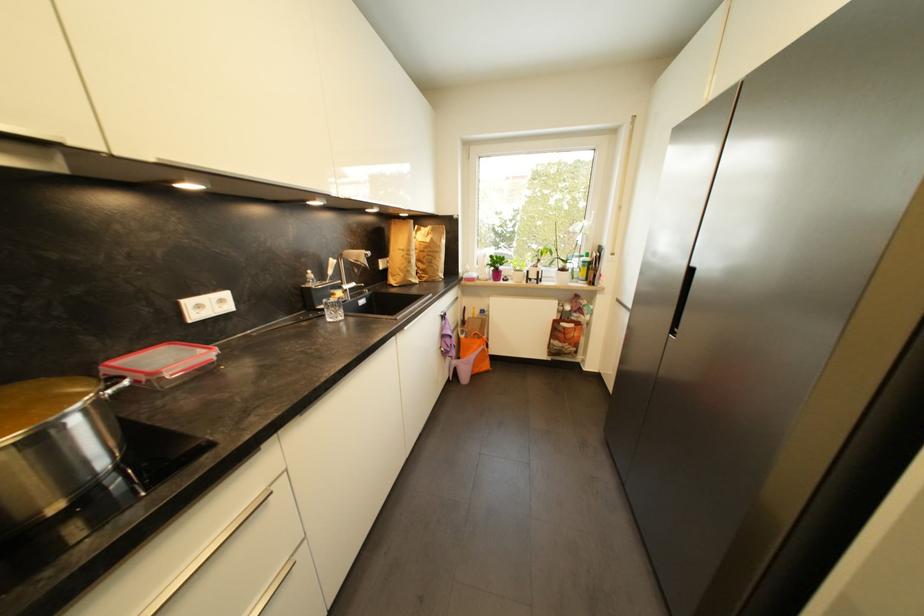
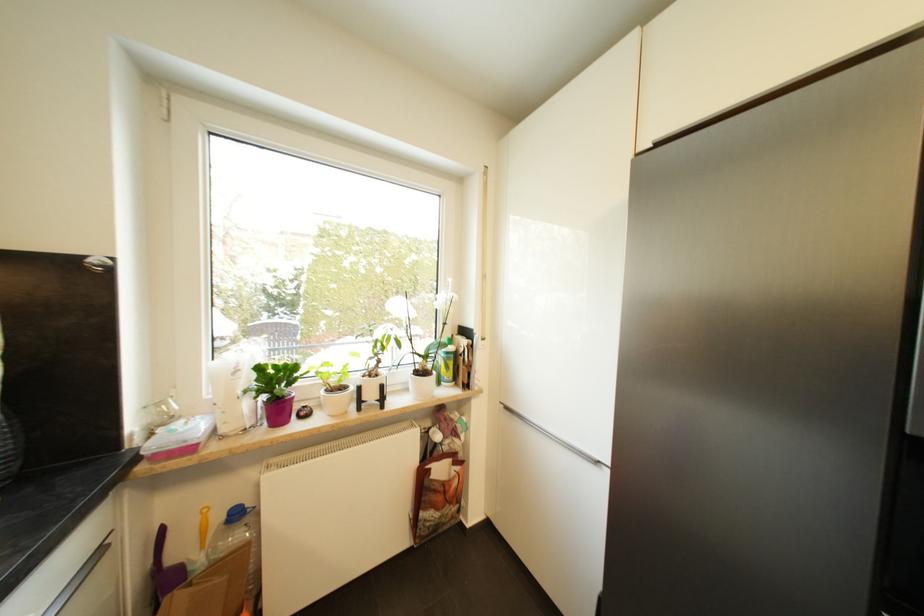
Question: I am providing you with two images of the same scene from different viewpoints. Which of the following objects are not visible in image2?

Choices:
 (A) silver cabinet handle
 (B) silver drawer handle
 (C) white flower pot
 (D) none of these

Answer: (D)